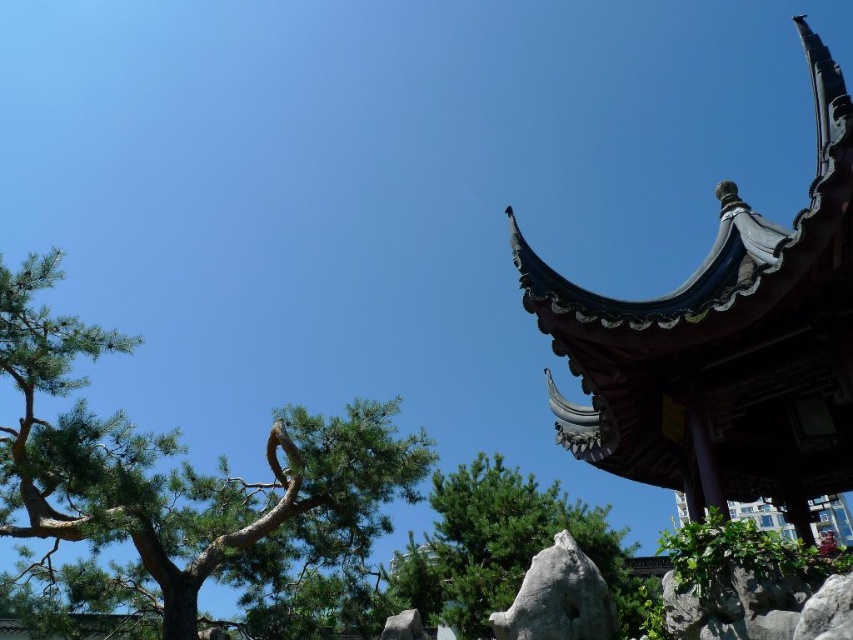
Question: Does green rough bark tree at upper left come in front of gray rough rock at center?

Choices:
 (A) yes
 (B) no

Answer: (B)

Question: Which point is closer to the camera?

Choices:
 (A) (219, 476)
 (B) (506, 470)
 (C) (541, 634)

Answer: (C)

Question: Which point is farther to the camera?

Choices:
 (A) (605, 554)
 (B) (173, 545)
 (C) (587, 611)

Answer: (A)

Question: Can you confirm if green rough bark tree at upper left is wider than gray rough rock at center?

Choices:
 (A) no
 (B) yes

Answer: (B)

Question: Can you confirm if green textured tree at center is positioned below gray rough rock at center?

Choices:
 (A) no
 (B) yes

Answer: (B)

Question: Based on their relative distances, which object is farther from the green rough bark tree at upper left?

Choices:
 (A) gray rough rock at center
 (B) green textured tree at center

Answer: (B)